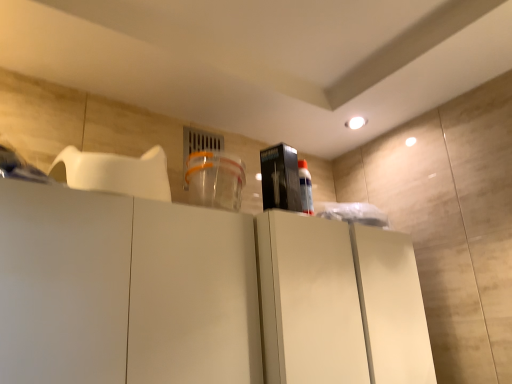
What is the approximate width of matte white cabinet at center?

→ It is 15.75 inches.

The width and height of the screenshot is (512, 384). I want to click on matte white cabinet at center, so click(x=339, y=303).

The image size is (512, 384). What do you see at coordinates (339, 303) in the screenshot?
I see `matte white cabinet at center` at bounding box center [339, 303].

Image resolution: width=512 pixels, height=384 pixels. Describe the element at coordinates (280, 178) in the screenshot. I see `black plastic box at center` at that location.

Locate an element on the screen. Image resolution: width=512 pixels, height=384 pixels. black plastic box at center is located at coordinates (280, 178).

This screenshot has height=384, width=512. I want to click on matte white cabinet at center, so click(x=339, y=303).

From the picture: Which object is positioned more to the right, matte white cabinet at center or black plastic box at center?

matte white cabinet at center.

Does matte white cabinet at center lie in front of black plastic box at center?

Yes, it is in front of black plastic box at center.

Is point (406, 282) positioned behind point (276, 191)?

That is True.

From the image's perspective, which one is positioned higher, matte white cabinet at center or black plastic box at center?

black plastic box at center appears higher in the image.

From a real-world perspective, is matte white cabinet at center over black plastic box at center?

Incorrect, from a real-world perspective, matte white cabinet at center is lower than black plastic box at center.

Which of these two, matte white cabinet at center or black plastic box at center, is wider?

Wider between the two is matte white cabinet at center.

Who is taller, matte white cabinet at center or black plastic box at center?

matte white cabinet at center.

Can you confirm if matte white cabinet at center is bigger than black plastic box at center?

Yes.

Would you say matte white cabinet at center contains black plastic box at center?

That's incorrect, black plastic box at center is not inside matte white cabinet at center.

Are matte white cabinet at center and black plastic box at center beside each other?

matte white cabinet at center and black plastic box at center are not in contact.

Is black plastic box at center at the back of matte white cabinet at center?

No, matte white cabinet at center is not facing the opposite direction of black plastic box at center.

At what (x,y) coordinates should I click in order to perform the action: click on cabinetry on the right of black plastic box at center. Please return your answer as a coordinate pair (x, y). Image resolution: width=512 pixels, height=384 pixels. Looking at the image, I should click on (339, 303).

Which is more to the left, black plastic box at center or matte white cabinet at center?

black plastic box at center.

Is the position of black plastic box at center more distant than that of matte white cabinet at center?

Yes.

Which is closer, (292, 184) or (428, 379)?

Clearly, point (292, 184) is more distant from the camera than point (428, 379).

From the image's perspective, does black plastic box at center appear lower than matte white cabinet at center?

No, from the image's perspective, black plastic box at center is not below matte white cabinet at center.

Based on the photo, from a real-world perspective, is black plastic box at center beneath matte white cabinet at center?

Actually, black plastic box at center is physically above matte white cabinet at center in the real world.

Is black plastic box at center wider or thinner than matte white cabinet at center?

In the image, black plastic box at center appears to be more narrow than matte white cabinet at center.

In terms of height, does black plastic box at center look taller or shorter compared to matte white cabinet at center?

black plastic box at center is shorter than matte white cabinet at center.

Does black plastic box at center have a smaller size compared to matte white cabinet at center?

Correct, black plastic box at center occupies less space than matte white cabinet at center.

Which is correct: black plastic box at center is inside matte white cabinet at center, or outside of it?

black plastic box at center is not inside matte white cabinet at center, it's outside.

Is black plastic box at center placed right next to matte white cabinet at center?

No, black plastic box at center is not touching matte white cabinet at center.

Is black plastic box at center looking in the opposite direction of matte white cabinet at center?

black plastic box at center is not turned away from matte white cabinet at center.

How different are the orientations of black plastic box at center and matte white cabinet at center in degrees?

The facing directions of black plastic box at center and matte white cabinet at center are 8.32e-05 degrees apart.

Where is `appliance lying above the matte white cabinet at center (from the image's perspective)`? The width and height of the screenshot is (512, 384). appliance lying above the matte white cabinet at center (from the image's perspective) is located at coordinates (280, 178).

Where is `cabinetry below the black plastic box at center (from the image's perspective)`? cabinetry below the black plastic box at center (from the image's perspective) is located at coordinates (339, 303).

You are a GUI agent. You are given a task and a screenshot of the screen. Output one action in this format:
    pyautogui.click(x=<x>, y=<y>)
    Task: Click on the cabinetry in front of the black plastic box at center
    The image size is (512, 384).
    Given the screenshot: What is the action you would take?
    pyautogui.click(x=339, y=303)